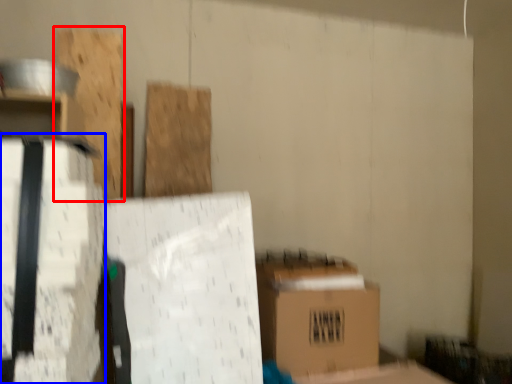
Question: Which of the following is the farthest to the observer, wood (highlighted by a red box) or cardboard box (highlighted by a blue box)?

Choices:
 (A) wood
 (B) cardboard box

Answer: (A)